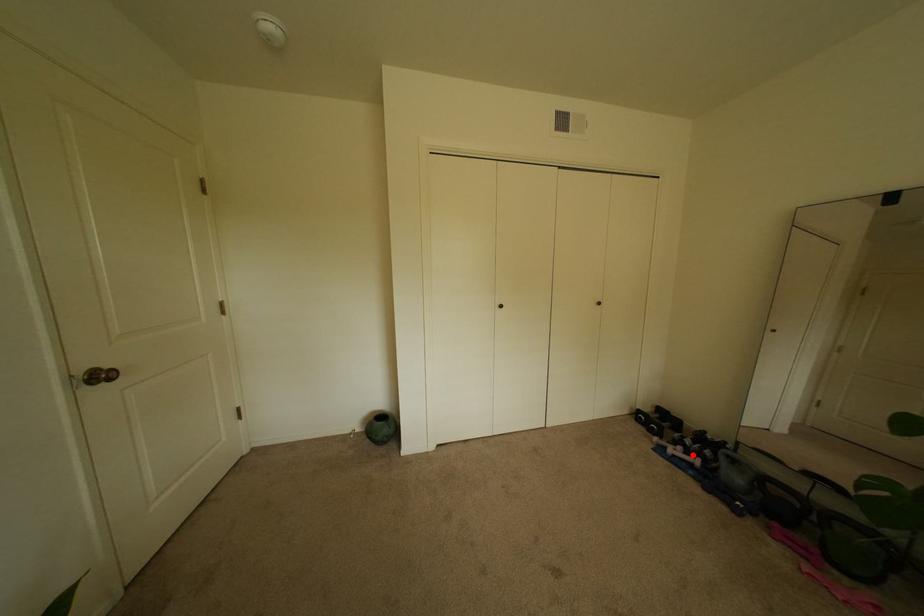
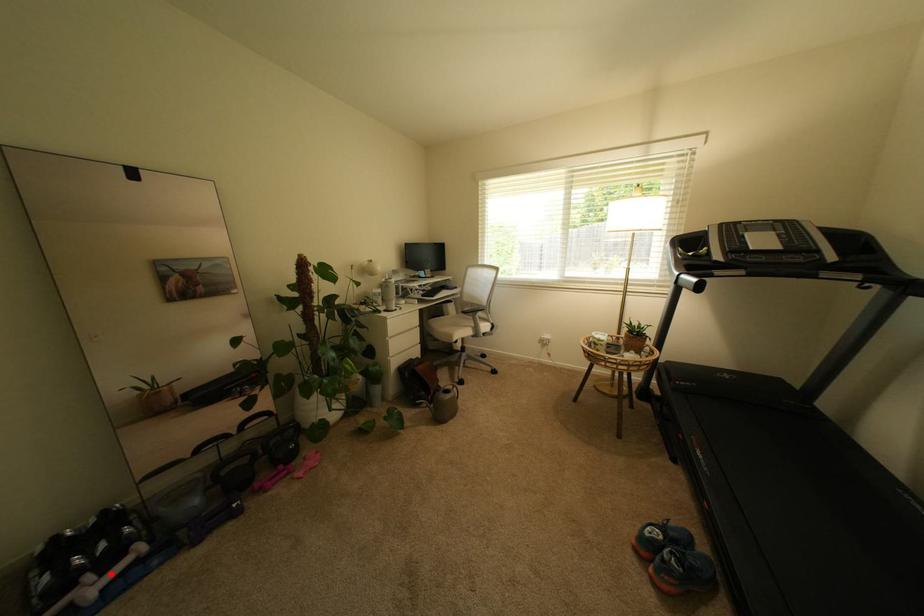
I am providing you with two images of the same scene from different viewpoints. A red point is marked on the first image and another point is marked on the second image. Do the highlighted points in image1 and image2 indicate the same real-world spot?

Yes